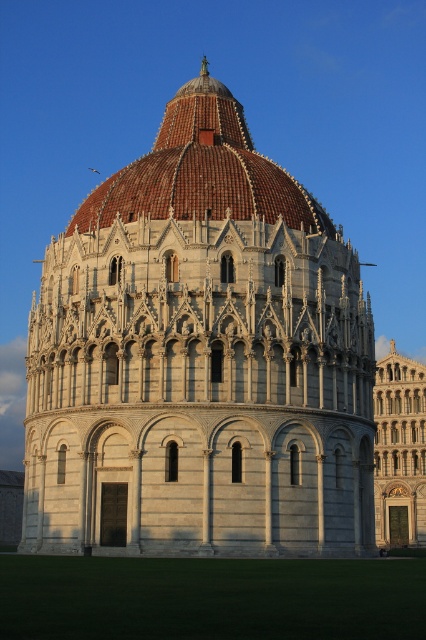
Consider the image. Is white stone tower at center positioned behind brown tiled dome at center?

No, it is not.

Describe the element at coordinates (199, 358) in the screenshot. I see `white stone tower at center` at that location.

You are a GUI agent. You are given a task and a screenshot of the screen. Output one action in this format:
    pyautogui.click(x=<x>, y=<y>)
    Task: Click on the white stone tower at center
    
    Given the screenshot: What is the action you would take?
    pyautogui.click(x=199, y=358)

Does white stone tower at center have a lesser width compared to golden stone tower at center?

No.

Who is positioned more to the right, white stone tower at center or golden stone tower at center?

golden stone tower at center

The width and height of the screenshot is (426, 640). Find the location of `white stone tower at center`. white stone tower at center is located at coordinates (199, 358).

Is the position of brown tiled dome at center less distant than that of golden stone tower at center?

That is True.

Can you confirm if brown tiled dome at center is positioned below golden stone tower at center?

No.

The height and width of the screenshot is (640, 426). Identify the location of brown tiled dome at center. (201, 172).